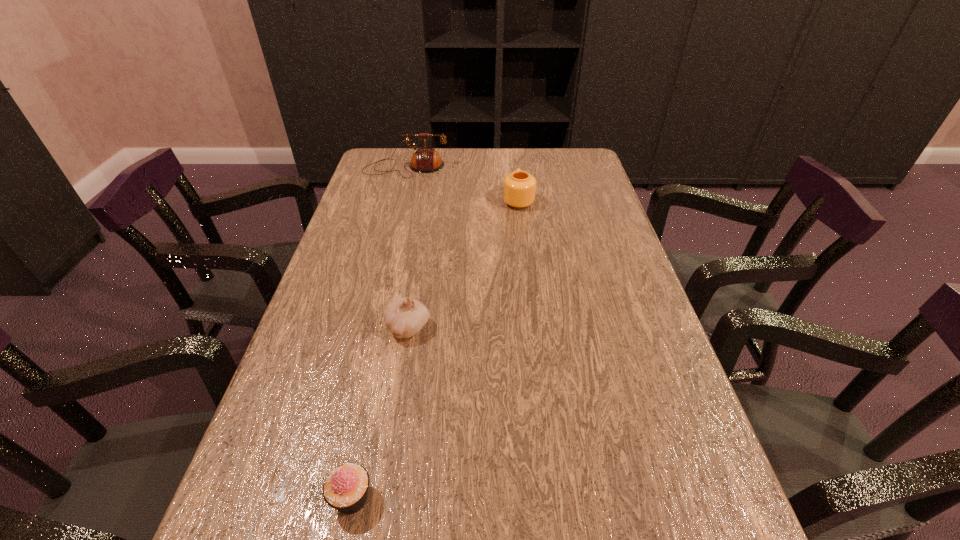
Where is `the tallest object`? This screenshot has width=960, height=540. the tallest object is located at coordinates (425, 160).

I want to click on the farthest object, so click(425, 160).

Find the location of a particular element. The height and width of the screenshot is (540, 960). the rightmost object is located at coordinates (519, 189).

The image size is (960, 540). In order to click on the third nearest object in this screenshot , I will do `click(519, 189)`.

I want to click on the second nearest object, so click(405, 317).

The width and height of the screenshot is (960, 540). What are the coordinates of `cupcake` in the screenshot? It's located at (346, 487).

I want to click on free space located 0.160m on the rotary dial of the telephone, so click(396, 207).

Locate an element on the screen. This screenshot has width=960, height=540. vacant area situated 0.230m on the handle side of the mug is located at coordinates (513, 155).

Find the location of a particular element. free space located 0.210m on the handle side of the mug is located at coordinates (514, 158).

Find the location of a particular element. The width and height of the screenshot is (960, 540). free space located on the handle side of the mug is located at coordinates pyautogui.click(x=515, y=165).